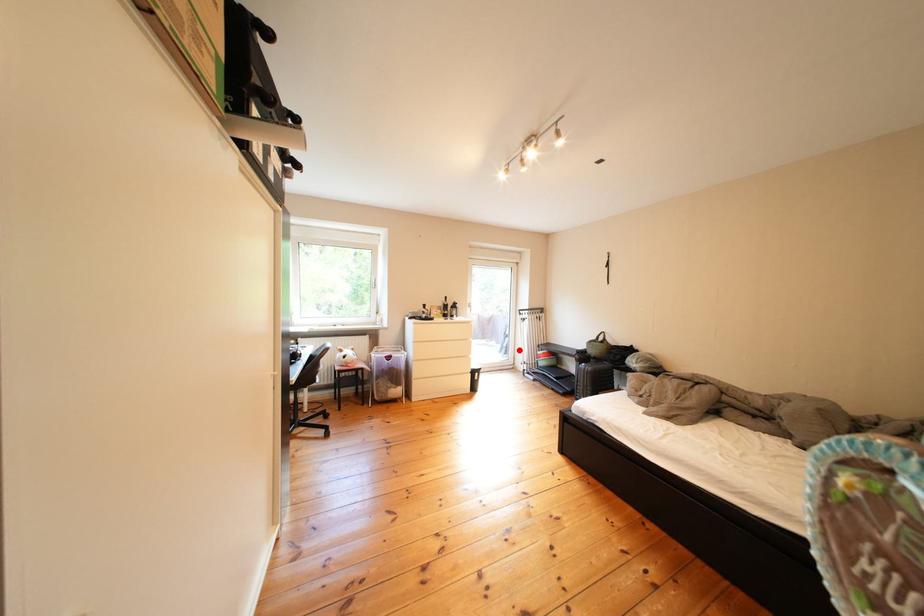
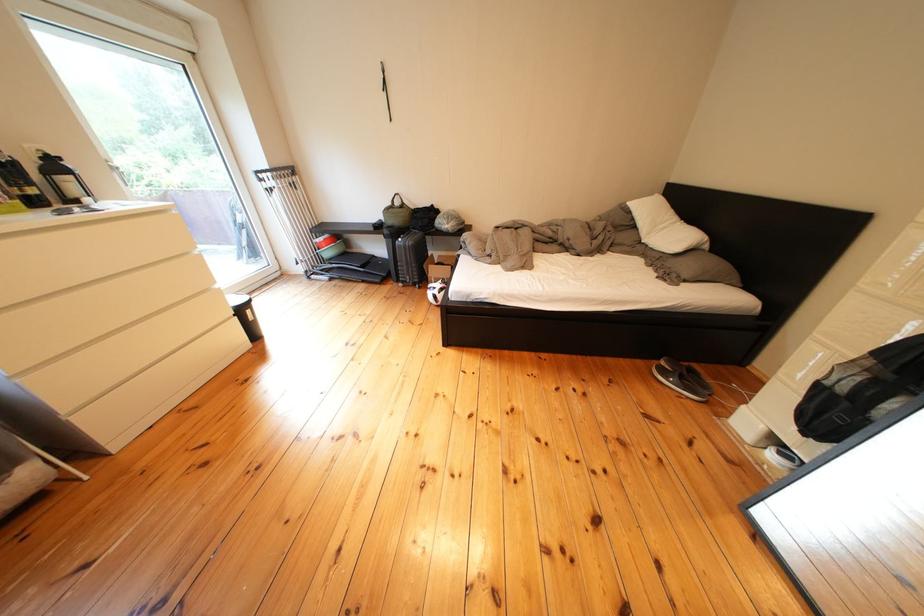
Where in the second image is the point corresponding to the highlighted location from the first image?

(259, 248)